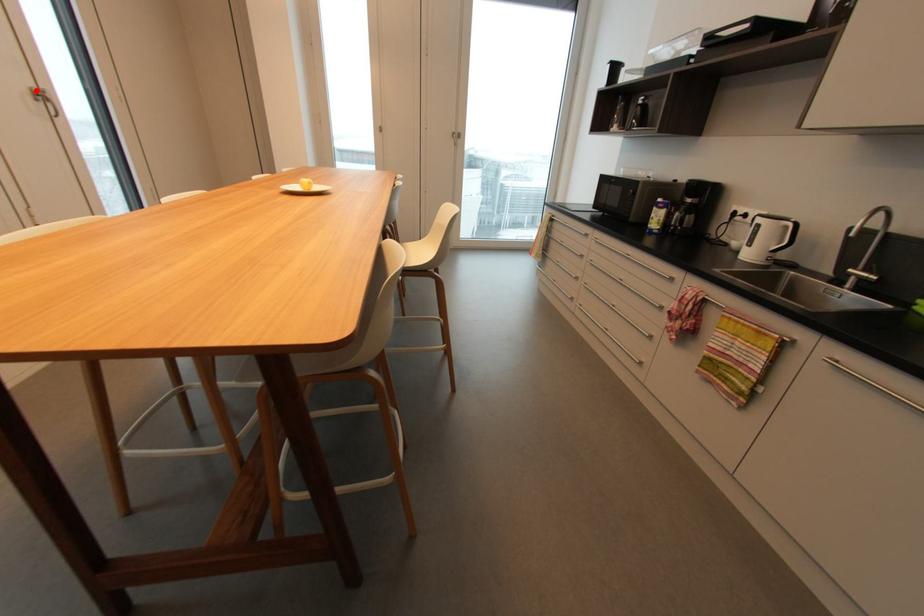
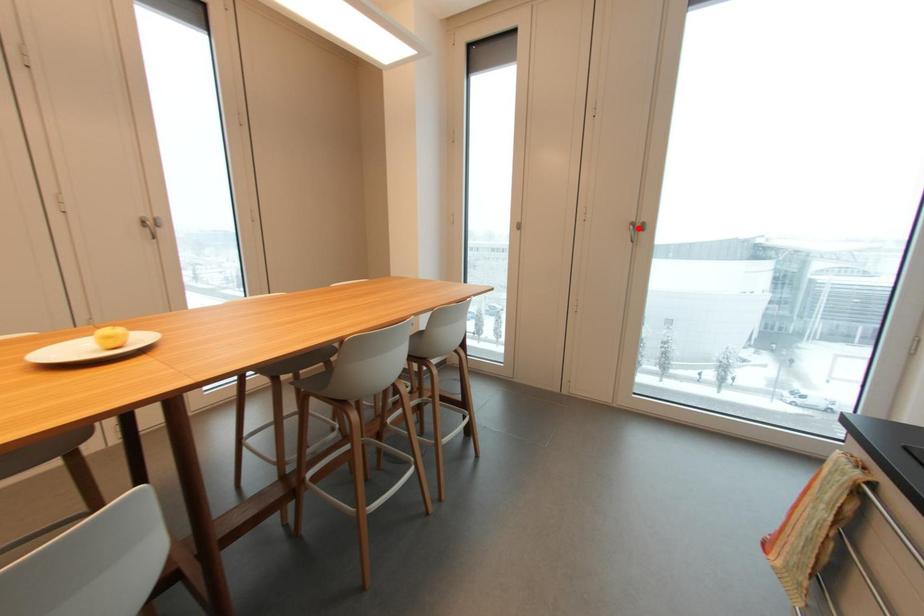
I am providing you with two images of the same scene from different viewpoints. A red point is marked on the first image and another point is marked on the second image. Is the red point in image1 aligned with the point shown in image2?

No